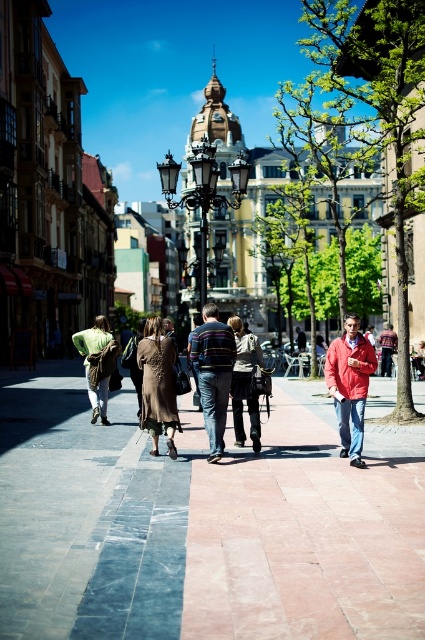
You are standing at the point marked as point [98,364] in the image. What object is exactly at your current location?

The green fabric bag at center is located at point [98,364].

You are a street performer in the European city scene. You have a striped cotton shirt at center and a green fabric bag at center. Which item can you use to cover yourself better during a sudden rain shower?

The striped cotton shirt at center is bigger than the green fabric bag at center, so it would provide better coverage during a rain shower.

You are standing at the pedestrian walkway in the European city scene. There are two points marked on the ground, one at coordinates point [107,356] and another at point [393,337]. If you want to walk from the point closer to you to the one further away, which point should you start from and which should you head towards?

You should start from point [107,356] and head towards point [393,337] because point [107,356] is in front of point [393,337], meaning it is closer to you.